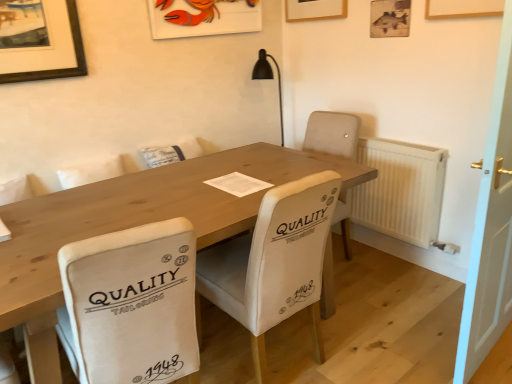
Question: Which direction should I rotate to face white fabric chair at center, arranged as the second chair when viewed from the left, — up or down?

Choices:
 (A) down
 (B) up

Answer: (A)

Question: Should I look upward or downward to see matte plastic picture frame at upper center, the 1th picture frame from the left?

Choices:
 (A) down
 (B) up

Answer: (B)

Question: Would you say matte plastic picture frame at upper center, which ranks as the 2th picture frame in right-to-left order, contains natural wood table at center?

Choices:
 (A) yes
 (B) no

Answer: (B)

Question: Is matte plastic picture frame at upper center, which ranks as the 2th picture frame in right-to-left order, at the left side of natural wood table at center?

Choices:
 (A) no
 (B) yes

Answer: (A)

Question: Is matte plastic picture frame at upper center, which ranks as the 2th picture frame in right-to-left order, wider than natural wood table at center?

Choices:
 (A) yes
 (B) no

Answer: (B)

Question: From a real-world perspective, does matte plastic picture frame at upper center, the 1th picture frame from the left, stand above natural wood table at center?

Choices:
 (A) yes
 (B) no

Answer: (A)

Question: Considering the relative sizes of matte plastic picture frame at upper center, the 1th picture frame from the left, and natural wood table at center in the image provided, is matte plastic picture frame at upper center, the 1th picture frame from the left, shorter than natural wood table at center?

Choices:
 (A) no
 (B) yes

Answer: (B)

Question: Is matte plastic picture frame at upper center, which ranks as the 2th picture frame in right-to-left order, turned away from natural wood table at center?

Choices:
 (A) yes
 (B) no

Answer: (B)

Question: Is wooden picture frame at upper right, which is the 1th picture frame from right to left, completely or partially outside of white plastic radiator at right?

Choices:
 (A) yes
 (B) no

Answer: (A)

Question: Is wooden picture frame at upper right, which is counted as the second picture frame, starting from the left, facing towards white plastic radiator at right?

Choices:
 (A) yes
 (B) no

Answer: (B)

Question: Is wooden picture frame at upper right, which is counted as the second picture frame, starting from the left, taller than white plastic radiator at right?

Choices:
 (A) no
 (B) yes

Answer: (A)

Question: Can you confirm if wooden picture frame at upper right, which is counted as the second picture frame, starting from the left, is positioned to the right of white plastic radiator at right?

Choices:
 (A) no
 (B) yes

Answer: (A)

Question: Can you confirm if wooden picture frame at upper right, which is counted as the second picture frame, starting from the left, is shorter than white plastic radiator at right?

Choices:
 (A) no
 (B) yes

Answer: (B)

Question: Does wooden picture frame at upper right, which is counted as the second picture frame, starting from the left, appear on the left side of white plastic radiator at right?

Choices:
 (A) no
 (B) yes

Answer: (B)

Question: Does white plastic radiator at right come in front of white wooden door at right?

Choices:
 (A) no
 (B) yes

Answer: (A)